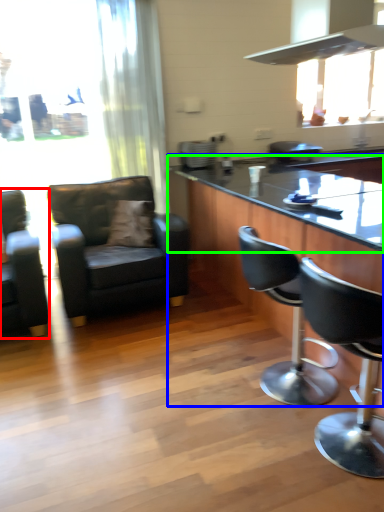
Question: Which is farther away from chair (highlighted by a red box)? table (highlighted by a blue box) or countertop (highlighted by a green box)?

Choices:
 (A) table
 (B) countertop

Answer: (B)